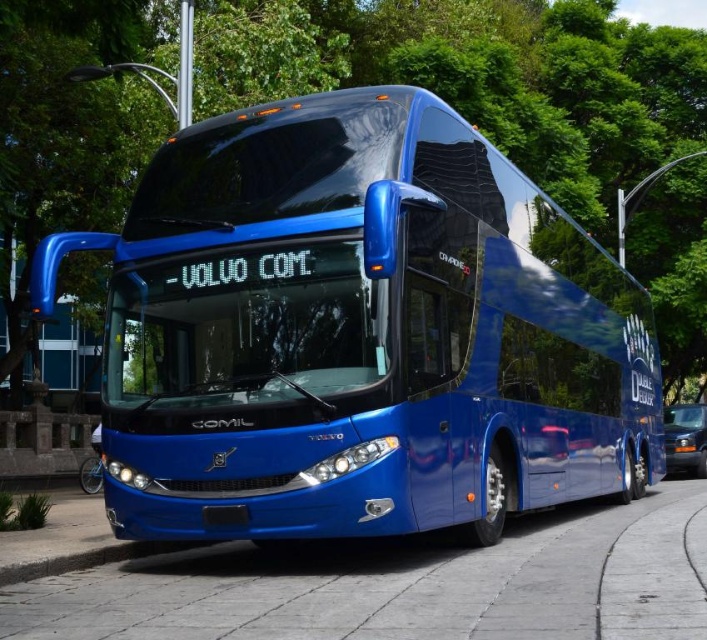
Question: Where is glossy blue bus at center located in relation to cobblestone pavement at center in the image?

Choices:
 (A) left
 (B) right

Answer: (B)

Question: Which of the following is the farthest from the observer?

Choices:
 (A) metallic silver car at lower right
 (B) cobblestone pavement at center
 (C) glossy blue bus at center

Answer: (A)

Question: Is cobblestone pavement at center bigger than metallic silver car at lower right?

Choices:
 (A) yes
 (B) no

Answer: (A)

Question: Which of the following is the closest to the observer?

Choices:
 (A) (691, 448)
 (B) (469, 582)
 (C) (286, 241)

Answer: (B)

Question: Which point appears closest to the camera in this image?

Choices:
 (A) (181, 536)
 (B) (549, 556)
 (C) (703, 460)

Answer: (A)

Question: Is glossy blue bus at center to the left of cobblestone pavement at center from the viewer's perspective?

Choices:
 (A) yes
 (B) no

Answer: (B)